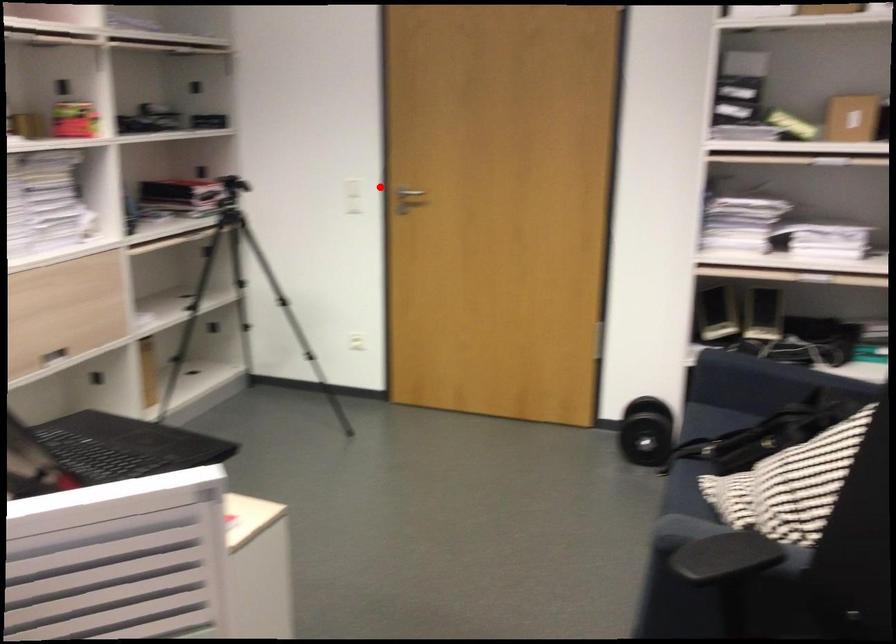
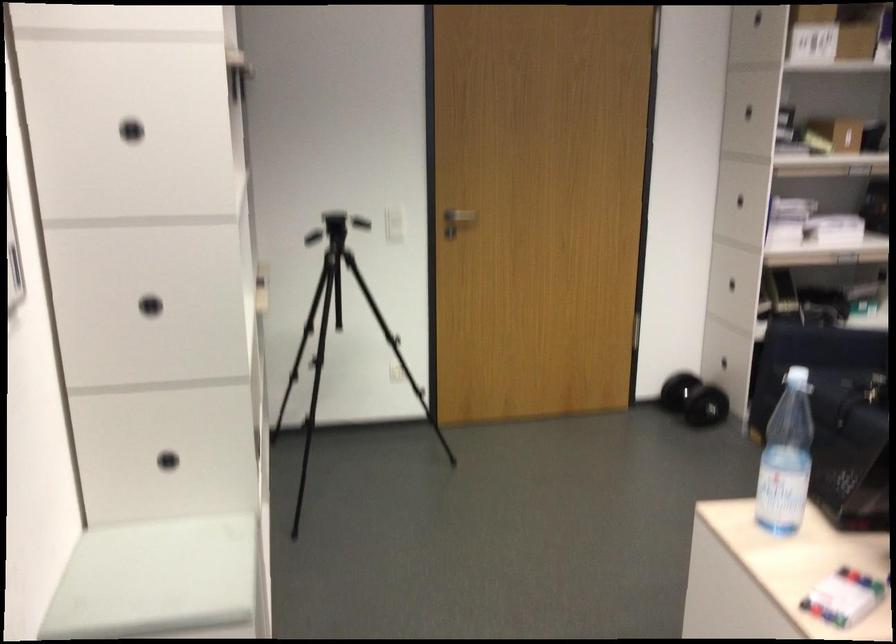
In the second image, find the point that corresponds to the highlighted location in the first image.

(393, 214)